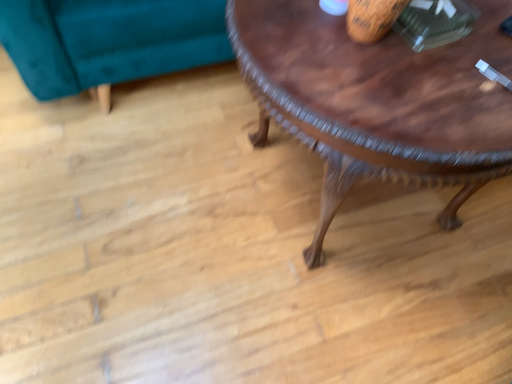
You are a GUI agent. You are given a task and a screenshot of the screen. Output one action in this format:
    pyautogui.click(x=<x>, y=<y>)
    Task: Click on the wooden carved coffee table at center
    
    Given the screenshot: What is the action you would take?
    pyautogui.click(x=378, y=101)

The height and width of the screenshot is (384, 512). What do you see at coordinates (378, 101) in the screenshot? I see `wooden carved coffee table at center` at bounding box center [378, 101].

What is the approximate width of wooden carved coffee table at center?

The width of wooden carved coffee table at center is 33.53 inches.

The image size is (512, 384). Describe the element at coordinates (109, 41) in the screenshot. I see `teal velvet swivel chair at upper left` at that location.

Find the location of a particular element. This screenshot has height=384, width=512. teal velvet swivel chair at upper left is located at coordinates (x=109, y=41).

What is the approximate width of teal velvet swivel chair at upper left?

33.73 inches.

Where is `wooden carved coffee table at center`? wooden carved coffee table at center is located at coordinates (378, 101).

Visually, is wooden carved coffee table at center positioned to the left or to the right of teal velvet swivel chair at upper left?

wooden carved coffee table at center is to the right of teal velvet swivel chair at upper left.

Considering the positions of objects wooden carved coffee table at center and teal velvet swivel chair at upper left in the image provided, who is in front, wooden carved coffee table at center or teal velvet swivel chair at upper left?

wooden carved coffee table at center is closer to the camera.

Is point (273, 104) positioned behind point (77, 69)?

No, (273, 104) is in front of (77, 69).

From the image's perspective, who appears lower, wooden carved coffee table at center or teal velvet swivel chair at upper left?

From the image's view, wooden carved coffee table at center is below.

From a real-world perspective, is wooden carved coffee table at center positioned over teal velvet swivel chair at upper left based on gravity?

Yes, from a real-world perspective, wooden carved coffee table at center is on top of teal velvet swivel chair at upper left.

Can you confirm if wooden carved coffee table at center is wider than teal velvet swivel chair at upper left?

In fact, wooden carved coffee table at center might be narrower than teal velvet swivel chair at upper left.

Which of these two, wooden carved coffee table at center or teal velvet swivel chair at upper left, stands shorter?

Standing shorter between the two is teal velvet swivel chair at upper left.

Considering the relative sizes of wooden carved coffee table at center and teal velvet swivel chair at upper left in the image provided, is wooden carved coffee table at center bigger than teal velvet swivel chair at upper left?

Correct, wooden carved coffee table at center is larger in size than teal velvet swivel chair at upper left.

Is wooden carved coffee table at center surrounding teal velvet swivel chair at upper left?

No, teal velvet swivel chair at upper left is not surrounded by wooden carved coffee table at center.

Is there a large distance between wooden carved coffee table at center and teal velvet swivel chair at upper left?

That's not correct — wooden carved coffee table at center is a little close to teal velvet swivel chair at upper left.

Is wooden carved coffee table at center facing away from teal velvet swivel chair at upper left?

Correct, wooden carved coffee table at center is looking away from teal velvet swivel chair at upper left.

How different are the orientations of wooden carved coffee table at center and teal velvet swivel chair at upper left in degrees?

2.5 degrees.

How distant is wooden carved coffee table at center from teal velvet swivel chair at upper left?

wooden carved coffee table at center is 69.71 centimeters from teal velvet swivel chair at upper left.

This screenshot has width=512, height=384. I want to click on swivel chair below the wooden carved coffee table at center (from a real-world perspective), so click(x=109, y=41).

Which is more to the right, teal velvet swivel chair at upper left or wooden carved coffee table at center?

wooden carved coffee table at center is more to the right.

Which is behind, teal velvet swivel chair at upper left or wooden carved coffee table at center?

teal velvet swivel chair at upper left is behind.

Is point (106, 14) in front of point (397, 150)?

No.

From the image's perspective, is teal velvet swivel chair at upper left on wooden carved coffee table at center?

Yes, from the image's perspective, teal velvet swivel chair at upper left is on top of wooden carved coffee table at center.

Consider the image. From a real-world perspective, is teal velvet swivel chair at upper left positioned under wooden carved coffee table at center based on gravity?

Indeed, from a real-world perspective, teal velvet swivel chair at upper left is positioned beneath wooden carved coffee table at center.

Can you confirm if teal velvet swivel chair at upper left is wider than wooden carved coffee table at center?

Correct, the width of teal velvet swivel chair at upper left exceeds that of wooden carved coffee table at center.

In terms of height, does teal velvet swivel chair at upper left look taller or shorter compared to wooden carved coffee table at center?

In the image, teal velvet swivel chair at upper left appears to be shorter than wooden carved coffee table at center.

Considering the relative sizes of teal velvet swivel chair at upper left and wooden carved coffee table at center in the image provided, is teal velvet swivel chair at upper left bigger than wooden carved coffee table at center?

Incorrect, teal velvet swivel chair at upper left is not larger than wooden carved coffee table at center.

Is teal velvet swivel chair at upper left located outside wooden carved coffee table at center?

Yes, teal velvet swivel chair at upper left is outside of wooden carved coffee table at center.

Is teal velvet swivel chair at upper left far from wooden carved coffee table at center?

teal velvet swivel chair at upper left is near wooden carved coffee table at center, not far away.

Is teal velvet swivel chair at upper left facing away from wooden carved coffee table at center?

teal velvet swivel chair at upper left is not turned away from wooden carved coffee table at center.

Looking at this image, what's the angular difference between teal velvet swivel chair at upper left and wooden carved coffee table at center's facing directions?

There is a 2.5-degree angle between the facing directions of teal velvet swivel chair at upper left and wooden carved coffee table at center.

Measure the distance from teal velvet swivel chair at upper left to wooden carved coffee table at center.

teal velvet swivel chair at upper left and wooden carved coffee table at center are 27.44 inches apart.

This screenshot has height=384, width=512. In the image, there is a wooden carved coffee table at center. What are the coordinates of `swivel chair above it (from the image's perspective)` in the screenshot? It's located at (109, 41).

Identify the location of swivel chair lying on the left of wooden carved coffee table at center. This screenshot has width=512, height=384. (109, 41).

I want to click on coffee table above the teal velvet swivel chair at upper left (from a real-world perspective), so click(378, 101).